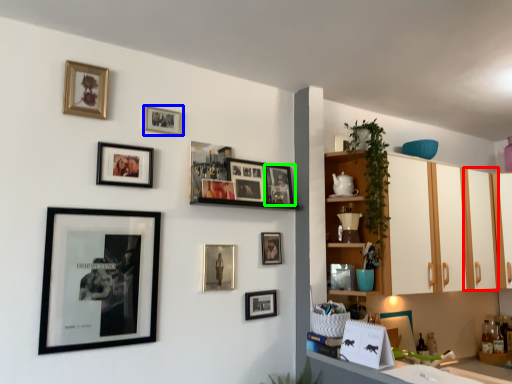
Question: Which object is the farthest from cabinetry (highlighted by a red box)? Choose among these: picture frame (highlighted by a blue box) or picture frame (highlighted by a green box).

Choices:
 (A) picture frame
 (B) picture frame

Answer: (A)